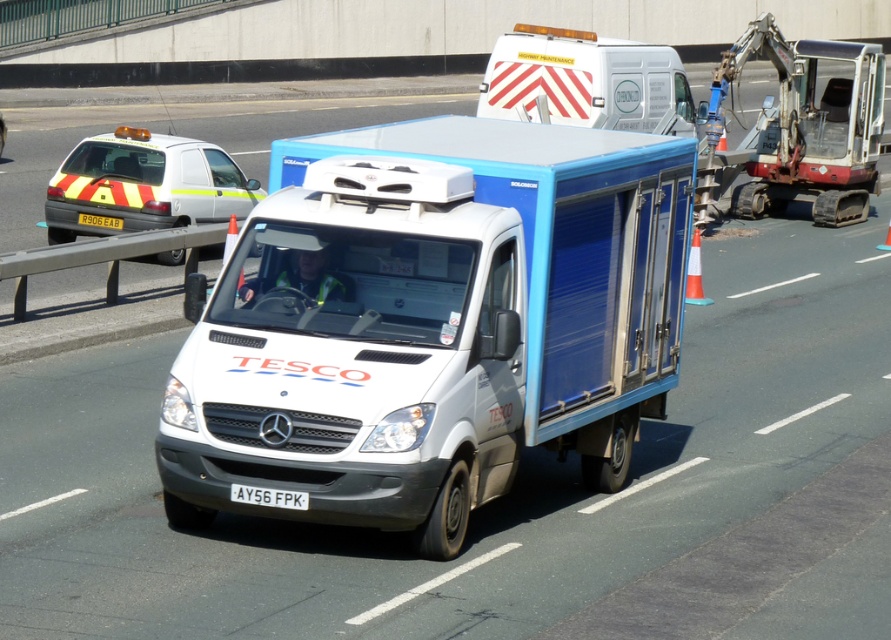
You are standing at point (715, 72). The white Mercedes van with Tesco logo is 40.30 meters away from you. Is the white car with yellow and red markings closer to you than the van?

The white car with yellow and red markings is 40.30 meters away from you, so yes, the white car with yellow and red markings is closer to you than the van.

You are a pedestrian standing at the center of the road. You see a yellow and black striped taxi at left. Where is the yellow and black striped taxi located relative to your position?

The yellow and black striped taxi at left is located at the left side of the road, positioned at coordinates approximately 0.289 on the x and 0.164 on the y axis relative to the center of the road.

You are a delivery driver looking at the road scene. You see a white plastic excavator at upper right and a white plastic license plate at center. Which object is taller?

The white plastic excavator at upper right is much taller than the white plastic license plate at center.